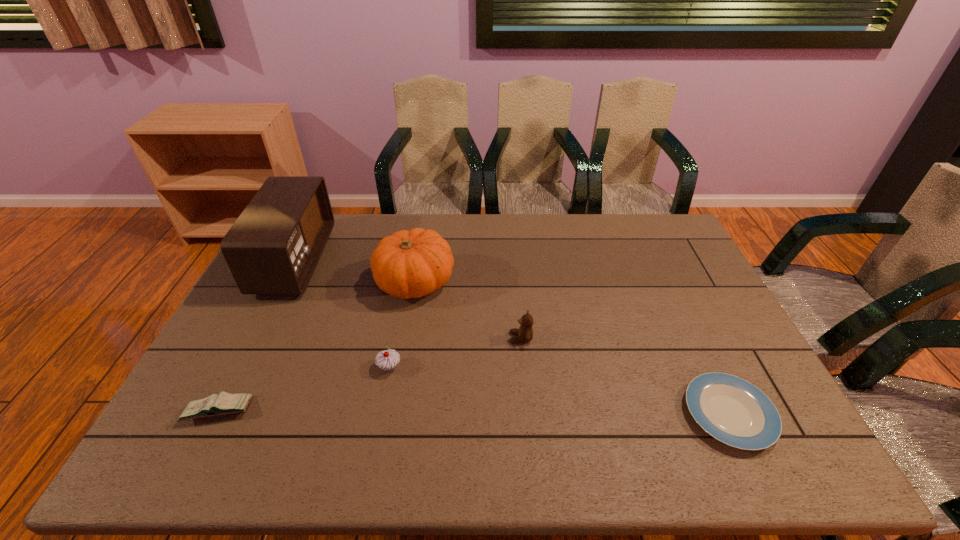
In order to click on object located in the right edge section of the desktop in this screenshot , I will do (732, 410).

Locate an element on the screen. object present at the far left corner is located at coordinates (274, 246).

Locate an element on the screen. The width and height of the screenshot is (960, 540). object located at the near right corner is located at coordinates pyautogui.click(x=732, y=410).

In the image, there is a desktop. Identify the location of blank space at the far edge. (345, 245).

Locate an element on the screen. The width and height of the screenshot is (960, 540). vacant area at the near edge is located at coordinates (529, 460).

In the image, there is a desktop. Where is `free space at the left edge`? This screenshot has height=540, width=960. free space at the left edge is located at coordinates (276, 306).

Find the location of a particular element. vacant space at the right edge is located at coordinates (708, 357).

You are a GUI agent. You are given a task and a screenshot of the screen. Output one action in this format:
    pyautogui.click(x=<x>, y=<y>)
    Task: Click on the vacant area that lies between the diary and the teddy bear
    Image resolution: width=960 pixels, height=540 pixels.
    Given the screenshot: What is the action you would take?
    pyautogui.click(x=370, y=374)

Locate an element on the screen. The width and height of the screenshot is (960, 540). free spot between the tallest object and the teddy bear is located at coordinates (408, 299).

Find the location of a particular element. empty space that is in between the radio receiver and the diary is located at coordinates (257, 336).